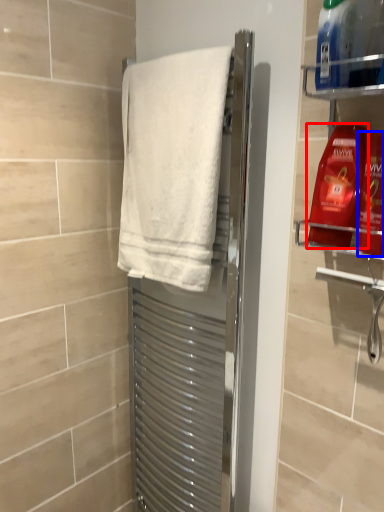
Question: Among these objects, which one is farthest to the camera, cleaning product (highlighted by a red box) or cleaning product (highlighted by a blue box)?

Choices:
 (A) cleaning product
 (B) cleaning product

Answer: (A)